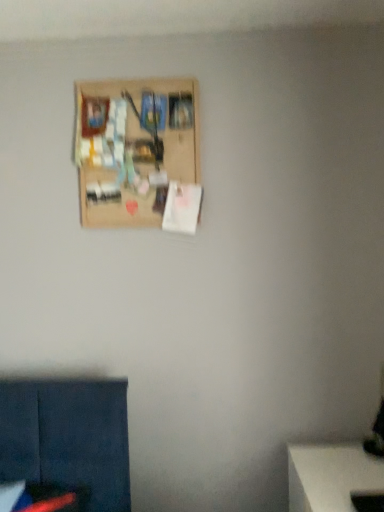
Measure the distance between point (x=169, y=120) and camera.

Point (x=169, y=120) and camera are 1.86 meters apart.

In order to face wooden board at upper center, should I rotate leftwards or rightwards?

To face it directly, rotate left by 7.224 degrees.

Where is `wooden board at upper center`? The width and height of the screenshot is (384, 512). wooden board at upper center is located at coordinates pos(139,154).

Describe the element at coordinates (139, 154) in the screenshot. This screenshot has width=384, height=512. I see `wooden board at upper center` at that location.

You are a GUI agent. You are given a task and a screenshot of the screen. Output one action in this format:
    pyautogui.click(x=<x>, y=<y>)
    Task: Click on the wooden board at upper center
    The width and height of the screenshot is (384, 512).
    Given the screenshot: What is the action you would take?
    pyautogui.click(x=139, y=154)